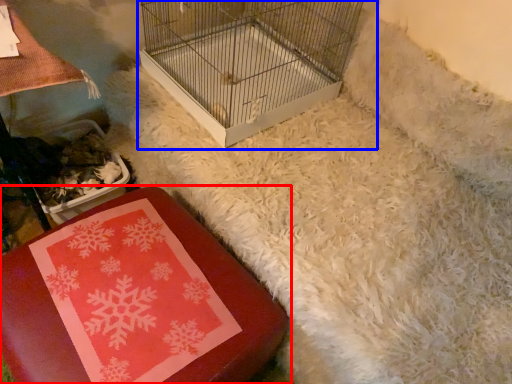
Question: Which object is closer to the camera taking this photo, furniture (highlighted by a red box) or bird cage (highlighted by a blue box)?

Choices:
 (A) furniture
 (B) bird cage

Answer: (A)